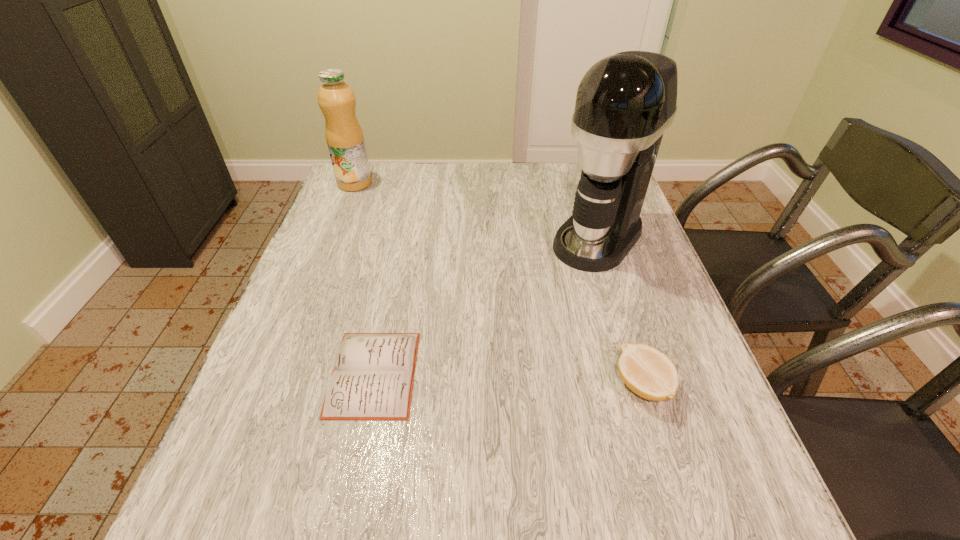
Where is `lemon present at the right edge`? This screenshot has height=540, width=960. lemon present at the right edge is located at coordinates (649, 373).

Identify the location of coffee maker that is at the right edge. The image size is (960, 540). (625, 102).

Locate an element on the screen. Image resolution: width=960 pixels, height=540 pixels. object present at the far left corner is located at coordinates pyautogui.click(x=344, y=136).

Find the location of a particular element. The height and width of the screenshot is (540, 960). object that is at the near left corner is located at coordinates (373, 375).

The image size is (960, 540). What are the coordinates of `object that is positioned at the near right corner` in the screenshot? It's located at (649, 373).

In order to click on vacant space at the far edge of the desktop in this screenshot , I will do `click(455, 168)`.

Find the location of a particular element. The image size is (960, 540). free space at the near edge is located at coordinates (512, 433).

Where is `vacant space at the left edge of the desktop`? The image size is (960, 540). vacant space at the left edge of the desktop is located at coordinates (354, 238).

Find the location of a particular element. vacant region at the right edge of the desktop is located at coordinates (675, 400).

At what (x,y) coordinates should I click in order to perform the action: click on empty space between the second farthest object and the diary. Please return your answer as a coordinate pair (x, y). The height and width of the screenshot is (540, 960). Looking at the image, I should click on (486, 305).